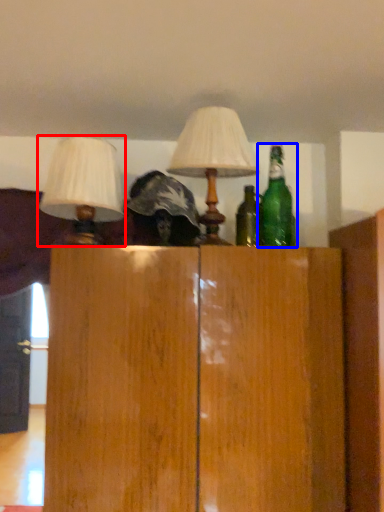
Question: Which object is further to the camera taking this photo, lamp (highlighted by a red box) or bottle (highlighted by a blue box)?

Choices:
 (A) lamp
 (B) bottle

Answer: (B)